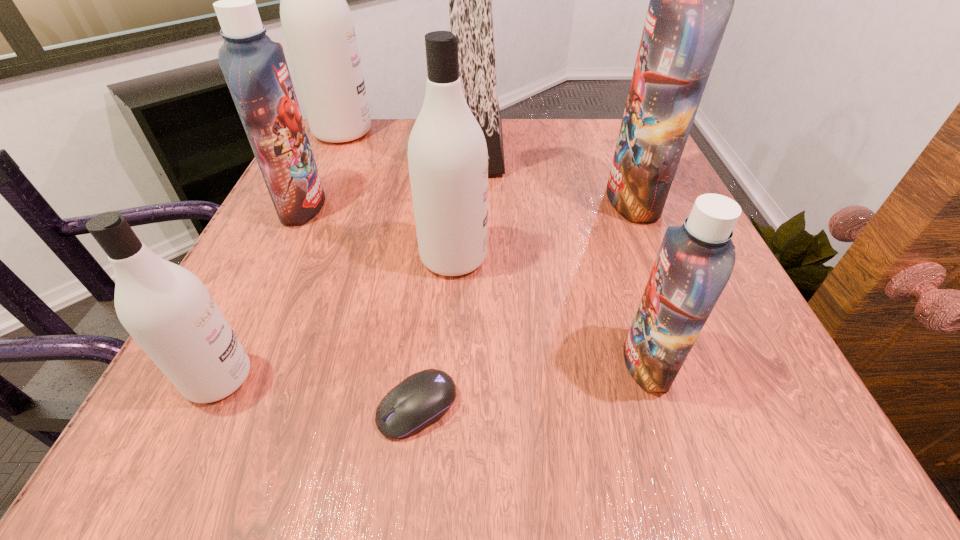
Find the location of a particular element. vacant space that satisfies the following two spatial constraints: 1. on the front-facing side of the smallest white shampoo; 2. on the left side of the computer mouse is located at coordinates (204, 407).

I want to click on free spot that satisfies the following two spatial constraints: 1. on the front-facing side of the smallest white shampoo; 2. on the left side of the computer mouse, so click(204, 407).

You are a GUI agent. You are given a task and a screenshot of the screen. Output one action in this format:
    pyautogui.click(x=<x>, y=<y>)
    Task: Click on the vacant region that satisfies the following two spatial constraints: 1. on the front-facing side of the farthest white shampoo; 2. on the back side of the black computer mouse
    
    Given the screenshot: What is the action you would take?
    pyautogui.click(x=216, y=407)